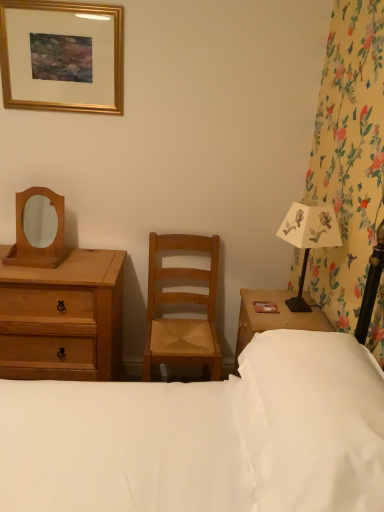
This screenshot has width=384, height=512. Identify the location of vacant space underneath wooden mirror at left (from a real-world perspective). (38, 264).